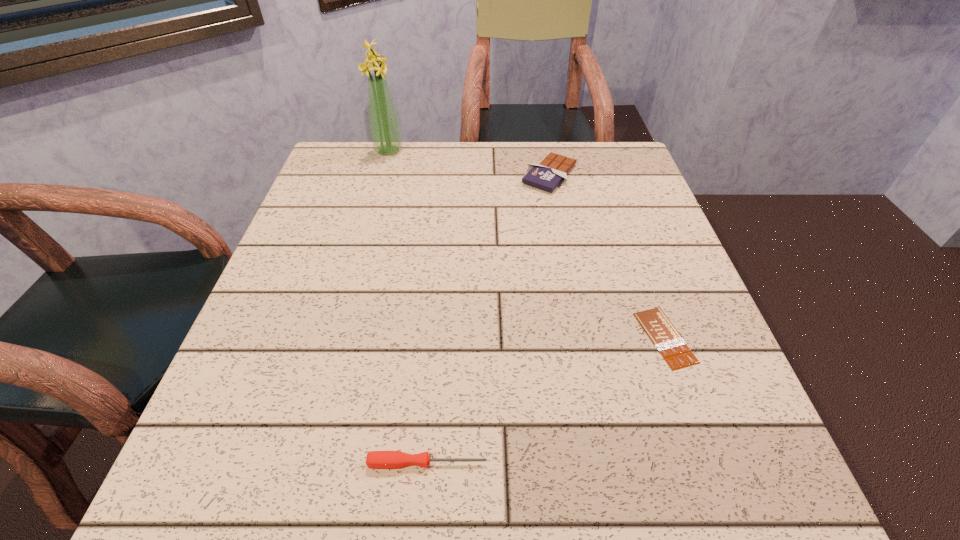
Find the location of a particular element. This screenshot has height=540, width=960. the leftmost object is located at coordinates (385, 130).

Identify the location of bouquet. The image size is (960, 540). (385, 130).

Where is `the left chocolate bar`? the left chocolate bar is located at coordinates (552, 170).

Where is `the second object from right to left`? The image size is (960, 540). the second object from right to left is located at coordinates (552, 170).

At what (x,y) coordinates should I click in order to perform the action: click on the second shortest object. Please return your answer as a coordinate pair (x, y). The height and width of the screenshot is (540, 960). Looking at the image, I should click on (375, 459).

Find the location of `screwdriver`. screwdriver is located at coordinates (375, 459).

You are a GUI agent. You are given a task and a screenshot of the screen. Output one action in this format:
    pyautogui.click(x=<x>, y=<y>)
    Task: Click on the second nearest object
    Image resolution: width=960 pixels, height=540 pixels.
    Given the screenshot: What is the action you would take?
    pyautogui.click(x=673, y=348)

Where is `the shortest object`? the shortest object is located at coordinates (673, 348).

The image size is (960, 540). Identify the location of free spot located on the front-facing side of the tallest object. coord(421,151).

The height and width of the screenshot is (540, 960). In order to click on blank space located 0.050m on the right of the farther chocolate bar in this screenshot , I will do `click(598, 175)`.